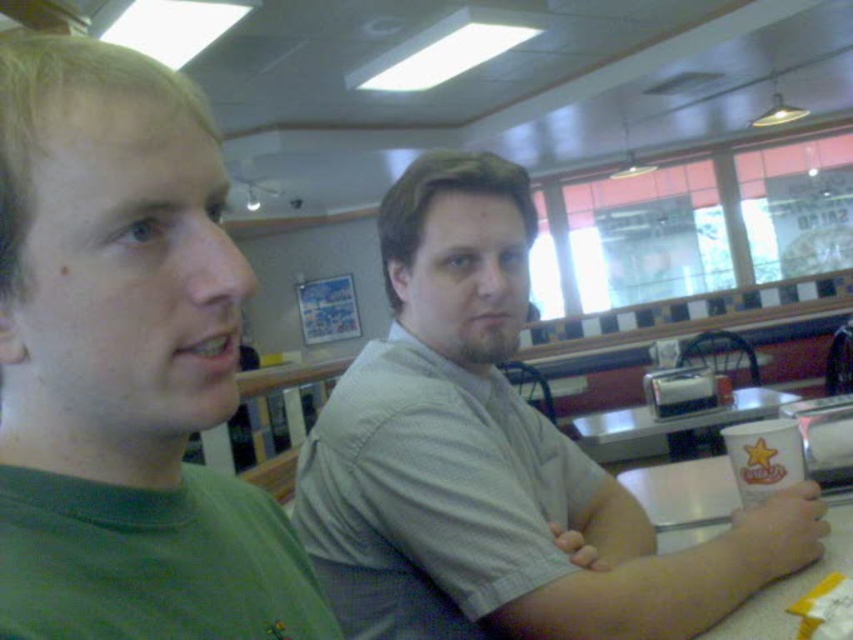
Question: Where is green matte shirt at left located in relation to gray textured shirt at center in the image?

Choices:
 (A) below
 (B) above

Answer: (B)

Question: Is green matte shirt at left bigger than white paper cup at right?

Choices:
 (A) yes
 (B) no

Answer: (B)

Question: Which point is farther to the camera?

Choices:
 (A) (776, 397)
 (B) (479, 264)

Answer: (A)

Question: Which object appears closest to the camera in this image?

Choices:
 (A) white paper cup at right
 (B) gray textured shirt at center
 (C) green matte shirt at left

Answer: (C)

Question: Can you confirm if green matte shirt at left is wider than white plastic table at lower right?

Choices:
 (A) no
 (B) yes

Answer: (A)

Question: Which of the following is the closest to the observer?

Choices:
 (A) (595, 448)
 (B) (784, 600)

Answer: (B)